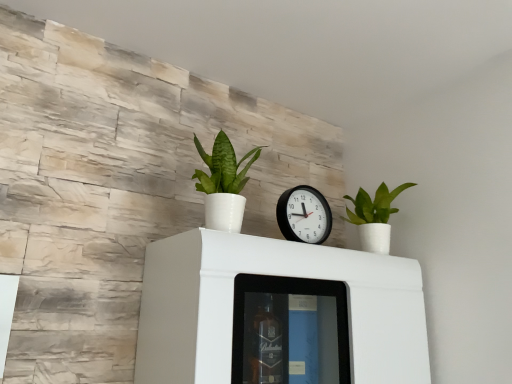
Question: Is white glossy cabinet at center touching green matte plant at upper right, which is counted as the second houseplant, starting from the left?

Choices:
 (A) no
 (B) yes

Answer: (A)

Question: Is green matte plant at upper right, which is the 2th houseplant from front to back, completely or partially inside white glossy cabinet at center?

Choices:
 (A) no
 (B) yes

Answer: (A)

Question: Can you confirm if white glossy cabinet at center is taller than green matte plant at upper right, which is the first houseplant in right-to-left order?

Choices:
 (A) no
 (B) yes

Answer: (B)

Question: Is white glossy cabinet at center facing away from green matte plant at upper right, which is the first houseplant in right-to-left order?

Choices:
 (A) no
 (B) yes

Answer: (A)

Question: Considering the relative positions of white glossy cabinet at center and green matte plant at upper right, the first houseplant from the back, in the image provided, is white glossy cabinet at center to the left of green matte plant at upper right, the first houseplant from the back, from the viewer's perspective?

Choices:
 (A) no
 (B) yes

Answer: (B)

Question: Is black plastic wall clock at center wider or thinner than green glossy plant at center, the first houseplant viewed from the front?

Choices:
 (A) thin
 (B) wide

Answer: (A)

Question: Does point (316, 201) appear closer or farther from the camera than point (226, 221)?

Choices:
 (A) farther
 (B) closer

Answer: (A)

Question: Would you say black plastic wall clock at center is to the left or to the right of green glossy plant at center, the second houseplant in the back-to-front sequence, in the picture?

Choices:
 (A) right
 (B) left

Answer: (A)

Question: From their relative heights in the image, would you say black plastic wall clock at center is taller or shorter than green glossy plant at center, acting as the 2th houseplant starting from the right?

Choices:
 (A) short
 (B) tall

Answer: (A)

Question: Based on their sizes in the image, would you say white glossy cabinet at center is bigger or smaller than green glossy plant at center, acting as the 1th houseplant starting from the left?

Choices:
 (A) small
 (B) big

Answer: (B)

Question: Visually, is white glossy cabinet at center positioned to the left or to the right of green glossy plant at center, the second houseplant in the back-to-front sequence?

Choices:
 (A) left
 (B) right

Answer: (B)

Question: From the image's perspective, is white glossy cabinet at center above or below green glossy plant at center, the first houseplant viewed from the front?

Choices:
 (A) above
 (B) below

Answer: (B)

Question: From a real-world perspective, relative to green glossy plant at center, the first houseplant viewed from the front, is white glossy cabinet at center vertically above or below?

Choices:
 (A) above
 (B) below

Answer: (B)

Question: Choose the correct answer: Is white glossy cabinet at center inside green matte plant at upper right, the first houseplant from the back, or outside it?

Choices:
 (A) inside
 (B) outside

Answer: (B)

Question: From the image's perspective, is white glossy cabinet at center located above or below green matte plant at upper right, the first houseplant from the back?

Choices:
 (A) above
 (B) below

Answer: (B)